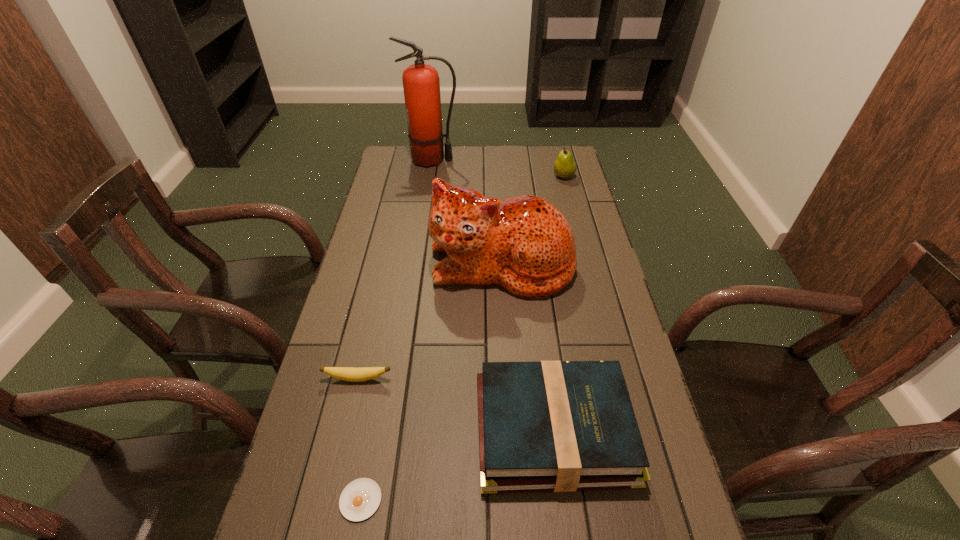
In order to click on vacant region that satisfies the following two spatial constraints: 1. on the nozzle of the fourth shortest object; 2. on the right side of the farthest object in this screenshot , I will do `click(429, 176)`.

Where is `vacant region that satisfies the following two spatial constraints: 1. on the nozzle of the hardback book; 2. on the left side of the tallest object`? The height and width of the screenshot is (540, 960). vacant region that satisfies the following two spatial constraints: 1. on the nozzle of the hardback book; 2. on the left side of the tallest object is located at coordinates (390, 429).

This screenshot has width=960, height=540. In order to click on free point that satisfies the following two spatial constraints: 1. on the face of the cat; 2. on the right side of the hardback book in this screenshot , I will do `click(511, 429)`.

Identify the location of vacant area in the image that satisfies the following two spatial constraints: 1. on the back side of the fifth tallest object; 2. on the left side of the fourth shortest object. (404, 176).

Where is `free point that satisfies the following two spatial constraints: 1. on the nozzle of the third tallest object; 2. on the left side of the tallest object`? The image size is (960, 540). free point that satisfies the following two spatial constraints: 1. on the nozzle of the third tallest object; 2. on the left side of the tallest object is located at coordinates (429, 176).

I want to click on free location that satisfies the following two spatial constraints: 1. on the back side of the fourth shortest object; 2. on the nozzle of the farthest object, so click(x=560, y=160).

Locate an element on the screen. free spot that satisfies the following two spatial constraints: 1. on the nozzle of the farthest object; 2. on the back side of the fourth tallest object is located at coordinates (390, 429).